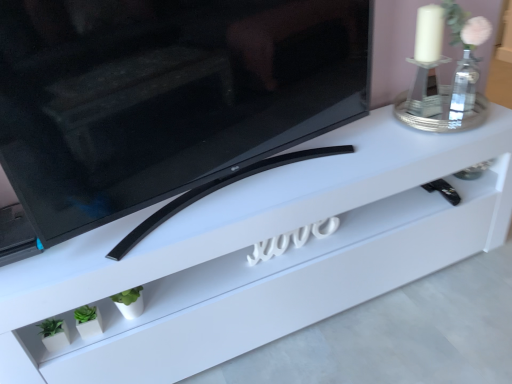
Locate an element on the screen. The image size is (512, 384). free space above white glossy tv stand at center (from a real-world perspective) is located at coordinates (291, 167).